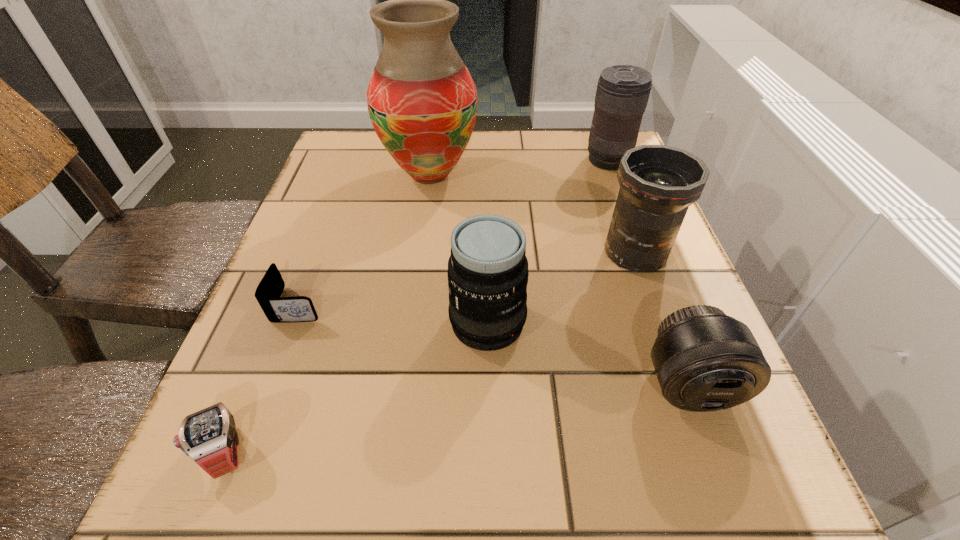
Identify the location of telephoto lens that is the second closest to the third farthest object. Image resolution: width=960 pixels, height=540 pixels. (487, 273).

Find the location of a particular element. vacant region that satisfies the following two spatial constraints: 1. on the outer surface of the leftmost telephoto lens; 2. on the left side of the wallet is located at coordinates (293, 323).

Locate an element on the screen. free space that satisfies the following two spatial constraints: 1. on the front side of the leftmost telephoto lens; 2. on the left side of the vase is located at coordinates (409, 323).

Find the location of a particular element. free point that satisfies the following two spatial constraints: 1. on the front side of the tallest object; 2. on the outer surface of the wallet is located at coordinates (412, 304).